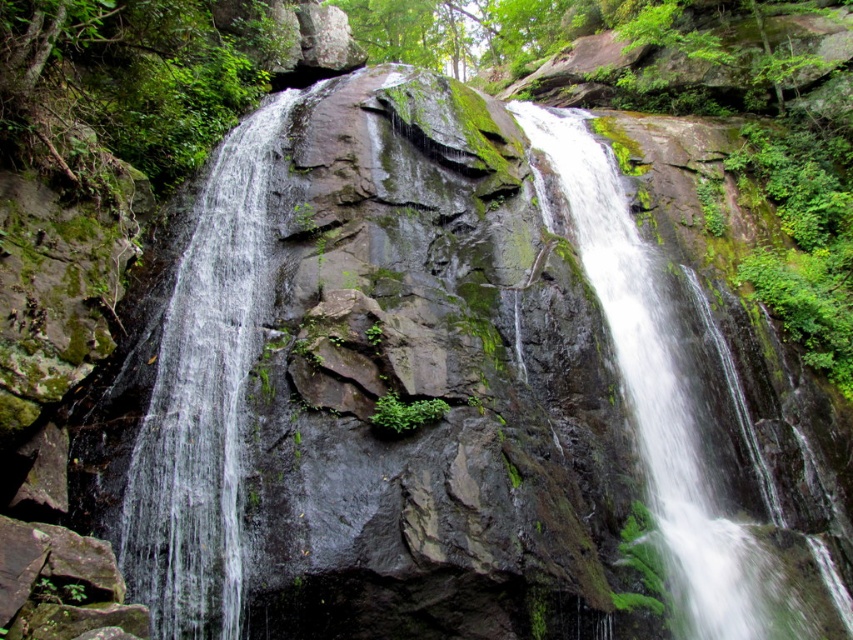
You are standing at the base of the waterfall and want to reach the point marked by point (276, 132) and point (718, 636). Which point is closer to you?

Point (718, 636) is closer to you because it is in front of point (276, 132).

You are standing at the base of the waterfall and notice a point marked at coordinates (204, 397). According to the image, what is located at this point?

The point at coordinates (204, 397) marks clear water at center.